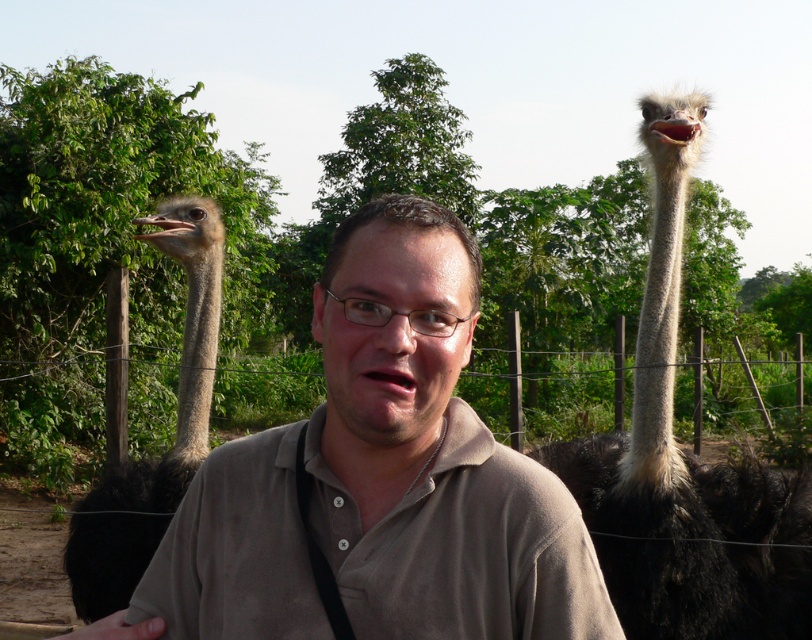
Question: Which of the following is the closest to the observer?

Choices:
 (A) (461, 413)
 (B) (383, 205)
 (C) (98, 497)
 (D) (752, 589)

Answer: (B)

Question: Among these points, which one is farthest from the camera?

Choices:
 (A) (637, 579)
 (B) (81, 598)

Answer: (B)

Question: Estimate the real-world distances between objects in this image. Which object is farther from the brown matte shirt at center?

Choices:
 (A) brown cotton shirt at center
 (B) dark brown feathers at right
 (C) dark brown feathers at left

Answer: (C)

Question: Is brown cotton shirt at center wider than brown matte shirt at center?

Choices:
 (A) yes
 (B) no

Answer: (A)

Question: Is brown cotton shirt at center thinner than dark brown feathers at left?

Choices:
 (A) yes
 (B) no

Answer: (B)

Question: Is dark brown feathers at right further to the viewer compared to brown matte shirt at center?

Choices:
 (A) yes
 (B) no

Answer: (A)